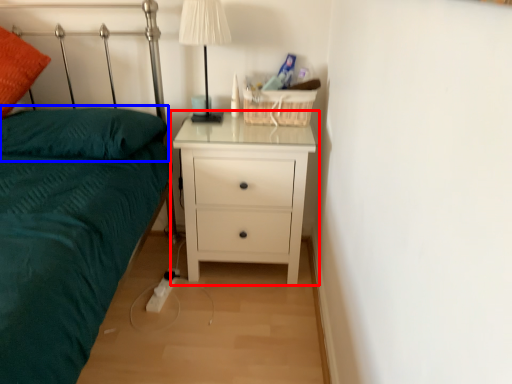
Question: Which object is further to the camera taking this photo, nightstand (highlighted by a red box) or pillow (highlighted by a blue box)?

Choices:
 (A) nightstand
 (B) pillow

Answer: (A)